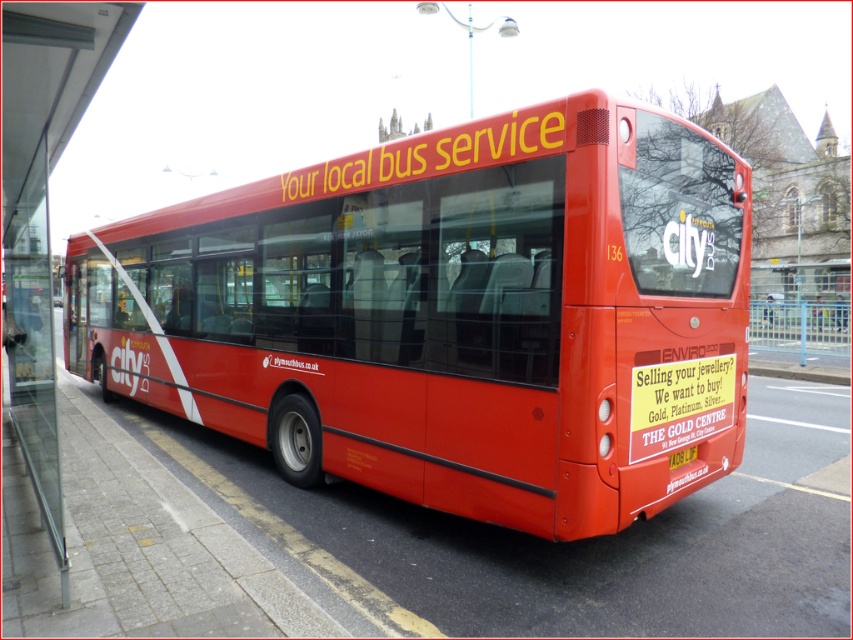
Question: Considering the relative positions of glossy red bus at center and yellow plastic license plate at center in the image provided, where is glossy red bus at center located with respect to yellow plastic license plate at center?

Choices:
 (A) right
 (B) left

Answer: (B)

Question: Which point is closer to the camera?

Choices:
 (A) yellow plastic license plate at center
 (B) glossy red bus at center

Answer: (B)

Question: Among these points, which one is farthest from the camera?

Choices:
 (A) (717, 193)
 (B) (674, 465)

Answer: (A)

Question: Is glossy red bus at center below yellow plastic license plate at center?

Choices:
 (A) no
 (B) yes

Answer: (A)

Question: Is glossy red bus at center to the right of yellow plastic license plate at center from the viewer's perspective?

Choices:
 (A) no
 (B) yes

Answer: (A)